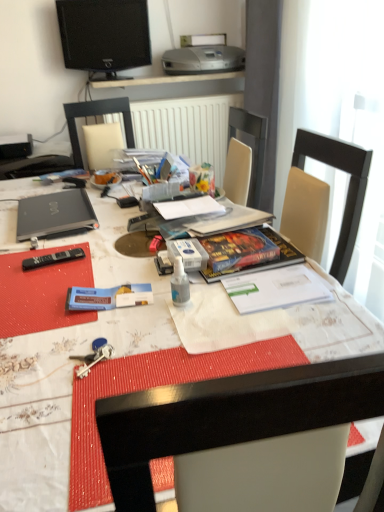
You are a GUI agent. You are given a task and a screenshot of the screen. Output one action in this format:
    pyautogui.click(x=<x>, y=<y>)
    Task: Click on the vacant space in front of black matte laptop at left
    The height and width of the screenshot is (512, 384).
    Given the screenshot: What is the action you would take?
    pyautogui.click(x=55, y=257)